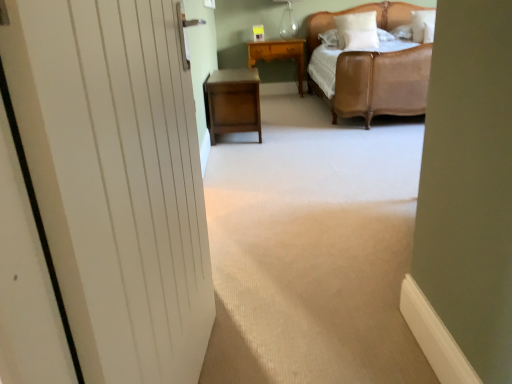
Question: Is point (76, 69) positioned closer to the camera than point (358, 31)?

Choices:
 (A) closer
 (B) farther

Answer: (A)

Question: Is white matte door at left situated inside white soft pillow at upper right, positioned as the third pillow in right-to-left order, or outside?

Choices:
 (A) inside
 (B) outside

Answer: (B)

Question: Estimate the real-world distances between objects in this image. Which object is closer to the wooden nightstand at center, the 2th nightstand positioned from the top?

Choices:
 (A) white soft pillow at upper center, marked as the second pillow in a left-to-right arrangement
 (B) leather bed at upper right
 (C) yellow wood nightstand at center, the 1th nightstand positioned from the top
 (D) white wood door at left
 (E) white matte door at left

Answer: (D)

Question: Considering the real-world distances, which object is farthest from the transparent glass table lamp at upper center?

Choices:
 (A) white wood door at left
 (B) white soft pillow at upper right, which is the first pillow in right-to-left order
 (C) white soft pillow at upper right, positioned as the third pillow in right-to-left order
 (D) yellow wood nightstand at center, positioned as the 2th nightstand in bottom-to-top order
 (E) white matte door at left

Answer: (E)